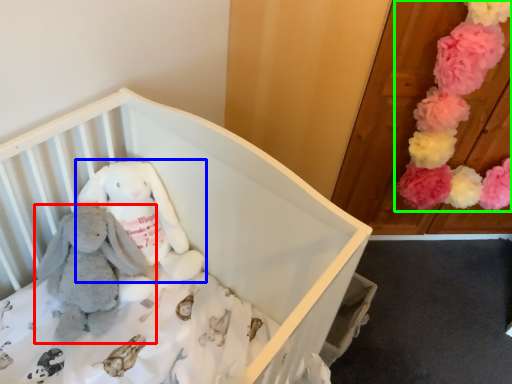
Question: Which is nearer to the toy (highlighted by a red box)? toy (highlighted by a blue box) or toy (highlighted by a green box).

Choices:
 (A) toy
 (B) toy

Answer: (A)